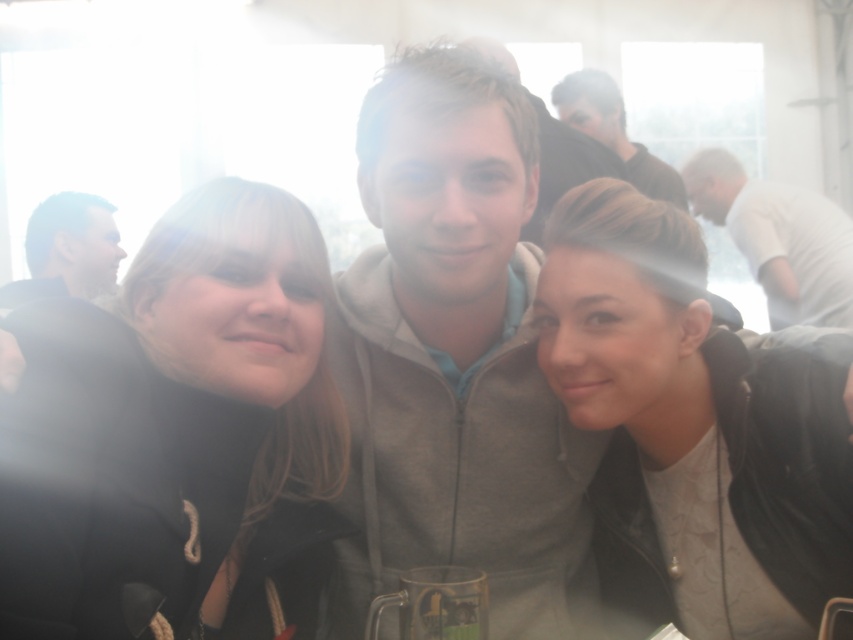
Question: Estimate the real-world distances between objects in this image. Which object is closer to the matte gray hoodie at center?

Choices:
 (A) matte black jacket at left
 (B) gray fleece jacket at center
 (C) matte black hoodie at upper center
 (D) transparent glass mug at center

Answer: (C)

Question: Estimate the real-world distances between objects in this image. Which object is farther from the matte black jacket at left?

Choices:
 (A) matte gray hoodie at center
 (B) black fuzzy coat at center
 (C) transparent glass mug at center
 (D) matte black hoodie at upper center

Answer: (C)

Question: Does gray fleece jacket at center have a larger size compared to matte black jacket at lower right?

Choices:
 (A) yes
 (B) no

Answer: (A)

Question: From the image, what is the correct spatial relationship of white smooth shirt at right in relation to transparent glass mug at center?

Choices:
 (A) right
 (B) left

Answer: (A)

Question: Which of these objects is positioned closest to the matte black hoodie at upper center?

Choices:
 (A) transparent glass mug at center
 (B) black fuzzy coat at center

Answer: (B)

Question: Considering the relative positions of matte black jacket at lower right and black fuzzy coat at center in the image provided, where is matte black jacket at lower right located with respect to black fuzzy coat at center?

Choices:
 (A) below
 (B) above

Answer: (A)